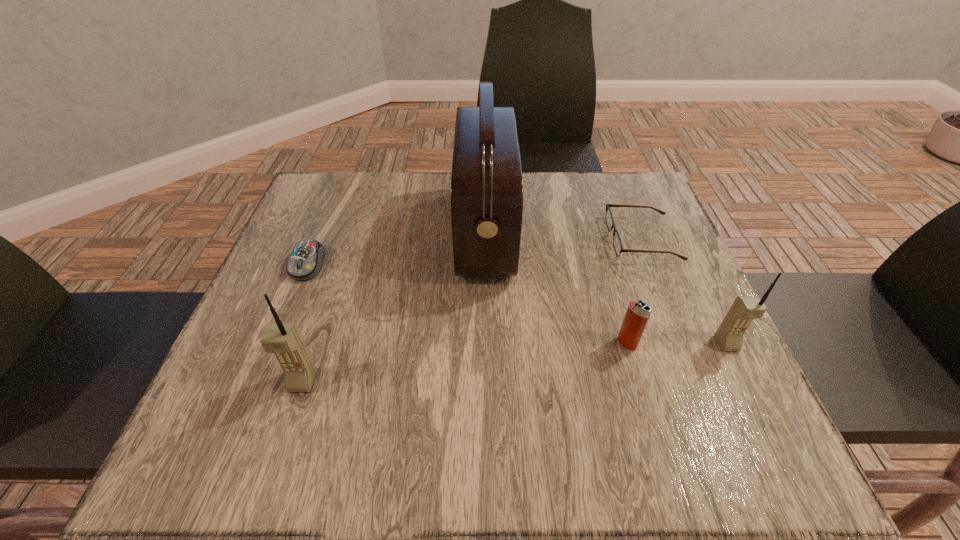
The width and height of the screenshot is (960, 540). In order to click on vacant space at the near edge of the desktop in this screenshot , I will do `click(429, 386)`.

Where is `blank space at the left edge of the desktop`? The image size is (960, 540). blank space at the left edge of the desktop is located at coordinates (334, 232).

The height and width of the screenshot is (540, 960). Identify the location of free region at the right edge of the desktop. coord(676,334).

The width and height of the screenshot is (960, 540). What are the coordinates of `vacant space at the far left corner` in the screenshot? It's located at (343, 207).

Locate an element on the screen. vacant area at the near left corner of the desktop is located at coordinates (276, 412).

Identify the location of vacant space at the far right corner. (643, 181).

At what (x,y) coordinates should I click in order to perform the action: click on vacant space at the near right corner of the desktop. Please return your answer as a coordinate pair (x, y). This screenshot has height=540, width=960. Looking at the image, I should click on (740, 410).

Locate an element on the screen. The image size is (960, 540). vacant space that is in between the third tallest object and the spectacles is located at coordinates (684, 291).

I want to click on free space between the taller cellular telephone and the radio receiver, so click(x=394, y=307).

Image resolution: width=960 pixels, height=540 pixels. I want to click on unoccupied area between the fourth object from right to left and the spectacles, so click(564, 235).